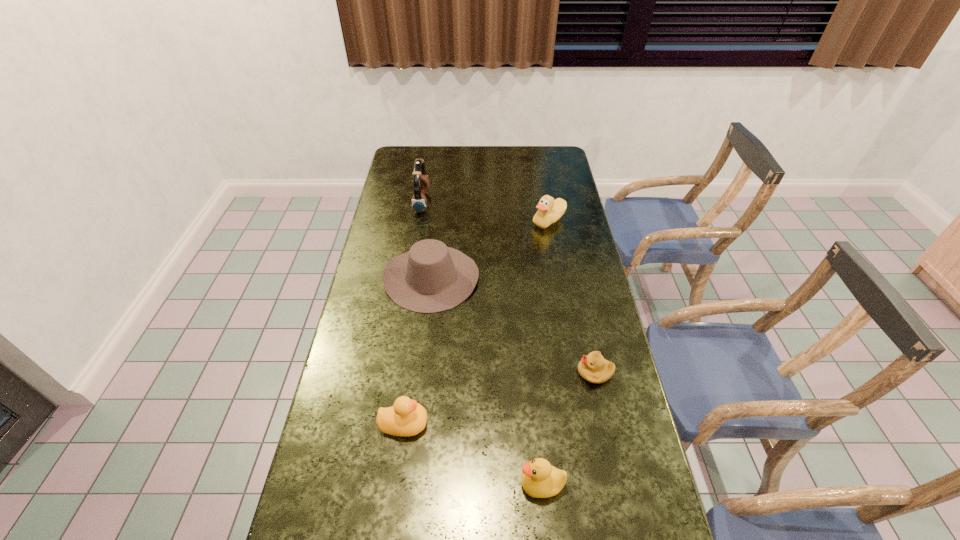
Select which object is the second closest to the third farthest object. Please provide its 2D coordinates. Your answer should be formatted as a tuple, i.e. [(x, y)], where the tuple contains the x and y coordinates of a point satisfying the conditions above.

[(549, 211)]

Locate an element on the screen. The width and height of the screenshot is (960, 540). duck object that ranks as the closest to the shortest object is located at coordinates (539, 479).

I want to click on duck that stands as the second closest to the fifth farthest object, so click(x=549, y=211).

Where is `vacant space that satisfies the following two spatial constraints: 1. on the ear cup of the headset; 2. on the left side of the cowboy hat`? Image resolution: width=960 pixels, height=540 pixels. vacant space that satisfies the following two spatial constraints: 1. on the ear cup of the headset; 2. on the left side of the cowboy hat is located at coordinates (410, 277).